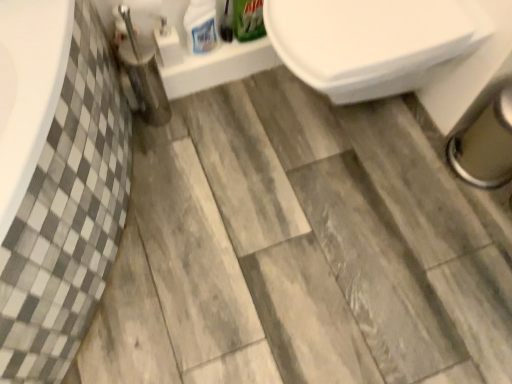
Identify the location of free point above white glossy toilet at upper right (from a real-world perspective). The width and height of the screenshot is (512, 384). (370, 24).